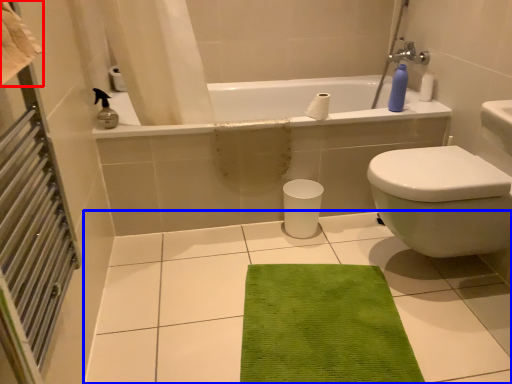
Question: Which object appears farthest to the camera in this image, beach towel (highlighted by a red box) or ceramic tile (highlighted by a blue box)?

Choices:
 (A) beach towel
 (B) ceramic tile

Answer: (B)